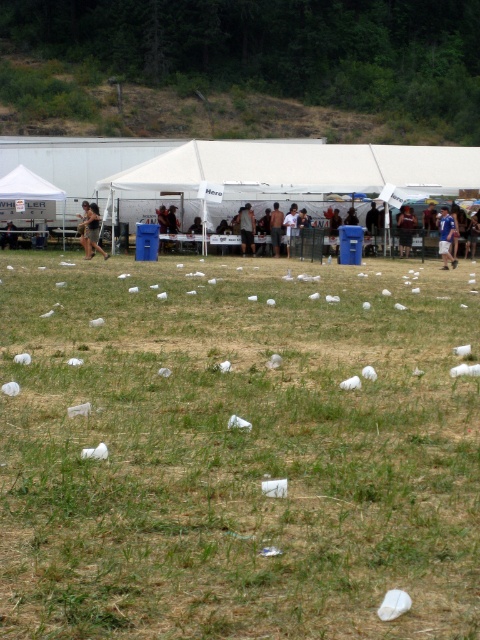
Who is more distant from viewer, (224,296) or (273,244)?

The point (273,244) is more distant.

Does green grass at center lie behind dark gray shirt at center?

No, it is not.

Between point (405, 579) and point (276, 248), which one is positioned behind?

The point (276, 248) is behind.

Where is `green grass at center`? green grass at center is located at coordinates (237, 452).

How much distance is there between green grass at center and dark blue shirt at center?

green grass at center is 23.61 meters from dark blue shirt at center.

Does green grass at center have a lesser width compared to dark blue shirt at center?

In fact, green grass at center might be wider than dark blue shirt at center.

Does point (60, 490) come farther from viewer compared to point (408, 230)?

No, it is not.

At what (x,y) coordinates should I click in order to perform the action: click on green grass at center. Please return your answer as a coordinate pair (x, y). This screenshot has height=640, width=480. Looking at the image, I should click on (237, 452).

Who is positioned more to the left, blue shirt at center or dark gray shirt at center?

From the viewer's perspective, dark gray shirt at center appears more on the left side.

Who is higher up, blue shirt at center or dark gray shirt at center?

Positioned higher is dark gray shirt at center.

Is point (441, 241) farther from camera compared to point (271, 228)?

That is False.

I want to click on blue shirt at center, so click(x=445, y=236).